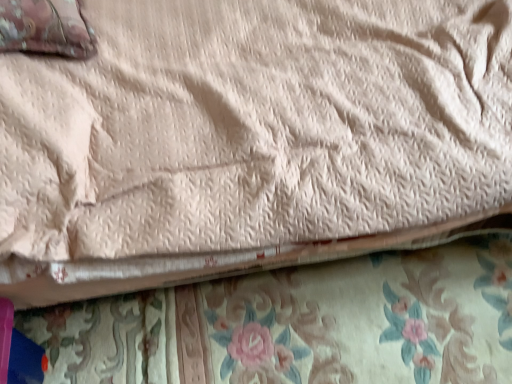
Question: Is point (19, 26) closer or farther from the camera than point (489, 304)?

Choices:
 (A) farther
 (B) closer

Answer: (B)

Question: From the image's perspective, is velvet-like pink pillow at upper left located above or below floral fabric at lower center?

Choices:
 (A) above
 (B) below

Answer: (A)

Question: Would you say velvet-like pink pillow at upper left is inside or outside floral fabric at lower center?

Choices:
 (A) outside
 (B) inside

Answer: (A)

Question: Looking at the image, does floral fabric at lower center seem bigger or smaller compared to velvet-like pink pillow at upper left?

Choices:
 (A) small
 (B) big

Answer: (A)

Question: Relative to velvet-like pink pillow at upper left, is floral fabric at lower center in front or behind?

Choices:
 (A) front
 (B) behind

Answer: (B)

Question: From the image's perspective, is floral fabric at lower center located above or below velvet-like pink pillow at upper left?

Choices:
 (A) below
 (B) above

Answer: (A)

Question: From their relative heights in the image, would you say floral fabric at lower center is taller or shorter than velvet-like pink pillow at upper left?

Choices:
 (A) tall
 (B) short

Answer: (B)